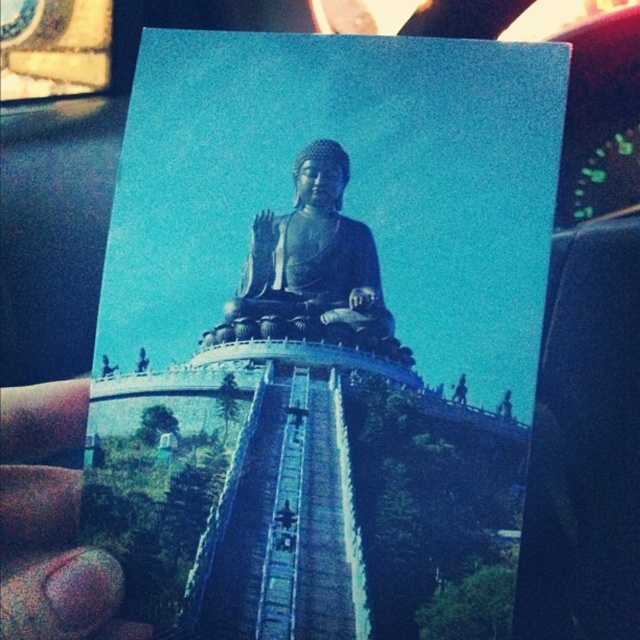
Question: Can you confirm if pink nail polish at lower left is wider than black polished statue at center?

Choices:
 (A) no
 (B) yes

Answer: (A)

Question: Is pink nail polish at lower left positioned in front of black polished statue at center?

Choices:
 (A) no
 (B) yes

Answer: (B)

Question: Where is metallic statue at center located in relation to pink nail polish at lower left in the image?

Choices:
 (A) left
 (B) right

Answer: (B)

Question: Which of the following is the farthest from the observer?

Choices:
 (A) pink nail polish at lower left
 (B) metallic statue at center
 (C) black polished statue at center

Answer: (C)

Question: Which point is farther from the camera taking this photo?

Choices:
 (A) (44, 576)
 (B) (349, 310)
 (C) (333, 182)

Answer: (B)

Question: Which of the following is the farthest from the observer?

Choices:
 (A) (51, 422)
 (B) (280, 280)
 (C) (360, 445)

Answer: (B)